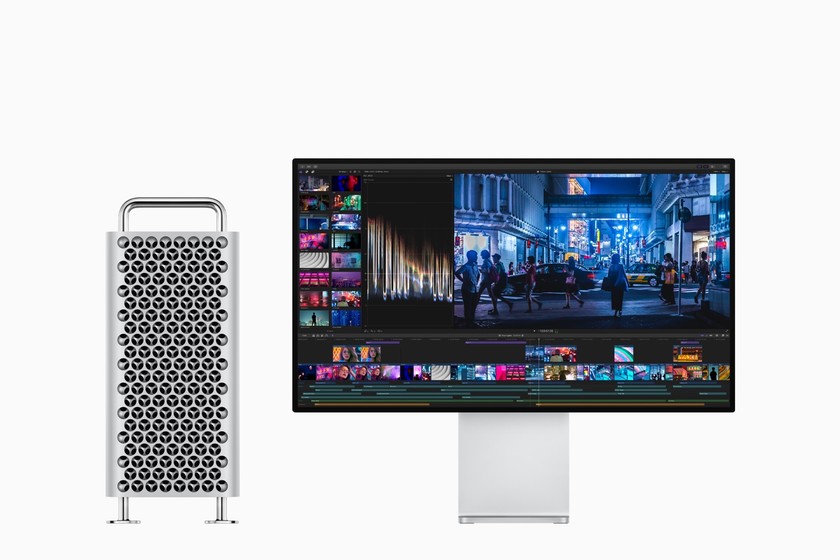
The height and width of the screenshot is (560, 840). Identify the location of monitor stand. (522, 465).